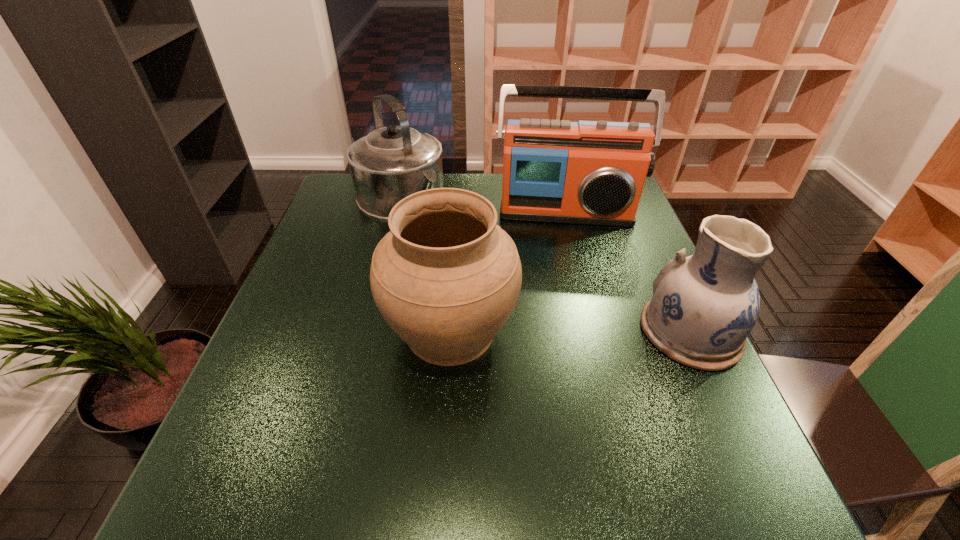
Identify the location of urn. The width and height of the screenshot is (960, 540). (446, 278).

This screenshot has height=540, width=960. I want to click on pottery, so click(x=704, y=306).

I want to click on kettle, so click(390, 163).

The height and width of the screenshot is (540, 960). Identify the location of radio receiver. (588, 172).

At what (x,y) coordinates should I click in order to perform the action: click on vacant space located 0.250m on the right of the urn. Please return your answer as a coordinate pair (x, y). Looking at the image, I should click on (632, 330).

This screenshot has height=540, width=960. Find the location of `free space located on the front of the pottery`. free space located on the front of the pottery is located at coordinates (733, 423).

Find the location of a particular element. vacant area located 0.210m with the spout at the front of the kettle is located at coordinates (462, 262).

The height and width of the screenshot is (540, 960). I want to click on free space located with the spout at the front of the kettle, so click(x=475, y=275).

Locate an element on the screen. Image resolution: width=960 pixels, height=540 pixels. vacant point located with the spout at the front of the kettle is located at coordinates (488, 287).

Identify the location of free spot located 0.210m on the front-facing side of the radio receiver. This screenshot has height=540, width=960. point(564,280).